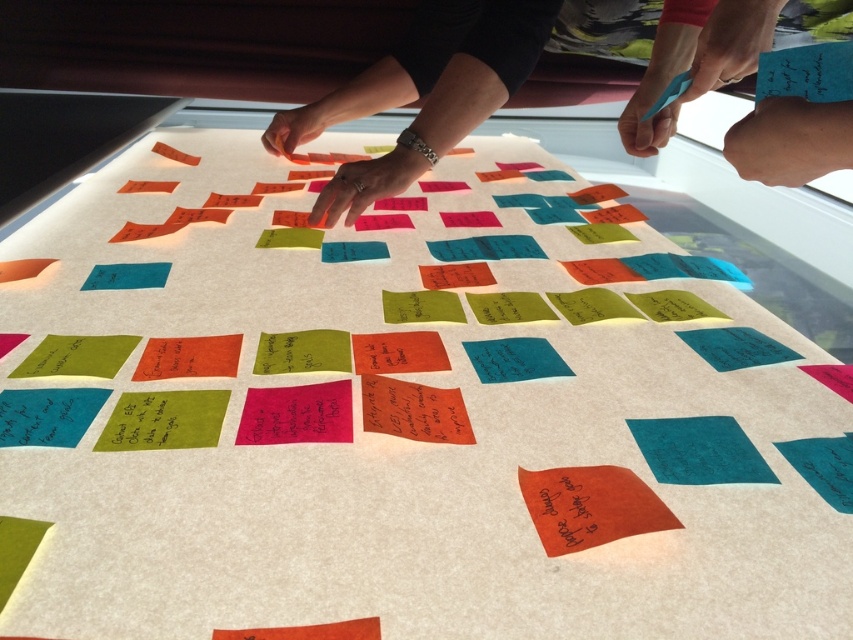
Can you confirm if smooth skin hands at upper center is positioned to the left of blue paper at upper right?

Indeed, smooth skin hands at upper center is positioned on the left side of blue paper at upper right.

Does point (351, 189) come closer to viewer compared to point (751, 157)?

That is False.

Locate an element on the screen. smooth skin hands at upper center is located at coordinates (422, 92).

The width and height of the screenshot is (853, 640). What do you see at coordinates (422, 92) in the screenshot? I see `smooth skin hands at upper center` at bounding box center [422, 92].

Does point (345, 96) come behind point (148, 124)?

No, (345, 96) is in front of (148, 124).

Image resolution: width=853 pixels, height=640 pixels. Describe the element at coordinates (422, 92) in the screenshot. I see `smooth skin hands at upper center` at that location.

Identify the location of smooth skin hands at upper center. (422, 92).

Does point (780, 8) lie behind point (103, 97)?

No.

Is blue paper at upper right positioned in front of orange sticky notes at upper left?

Yes, it is in front of orange sticky notes at upper left.

What do you see at coordinates (698, 65) in the screenshot?
I see `blue paper at upper right` at bounding box center [698, 65].

The image size is (853, 640). Find the location of `blue paper at upper right`. blue paper at upper right is located at coordinates (698, 65).